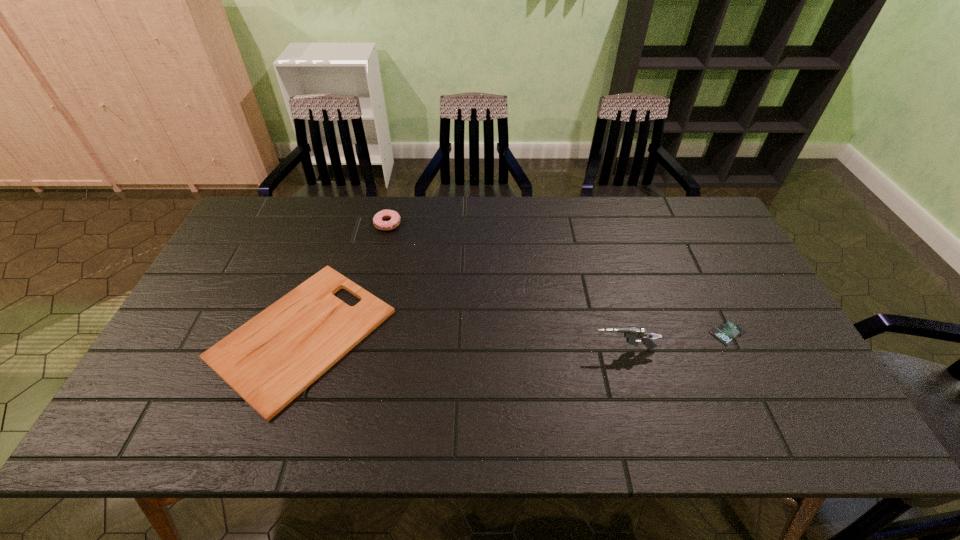
I want to click on unoccupied area between the third shortest object and the gun, so click(506, 287).

Where is `free spot between the tallest object and the third tallest object`? The image size is (960, 540). free spot between the tallest object and the third tallest object is located at coordinates (463, 341).

The height and width of the screenshot is (540, 960). Find the location of `free point between the gun and the rightmost object`. free point between the gun and the rightmost object is located at coordinates [x=676, y=341].

The height and width of the screenshot is (540, 960). Find the location of `object identified as the third closest to the shortest object`. object identified as the third closest to the shortest object is located at coordinates (378, 222).

This screenshot has width=960, height=540. In order to click on object that is the second closest to the chopping board in this screenshot , I will do `click(631, 334)`.

Find the location of a particular element. This screenshot has height=540, width=960. free spot that satisfies the following two spatial constraints: 1. on the back side of the doughnut; 2. on the right side of the second shortest object is located at coordinates (341, 224).

This screenshot has width=960, height=540. I want to click on vacant point that satisfies the following two spatial constraints: 1. on the back side of the second shortest object; 2. on the left side of the second tallest object, so click(x=341, y=224).

Identify the location of vacant region that satisfies the following two spatial constraints: 1. on the front side of the third shortest object; 2. on the right side of the rightmost object. The image size is (960, 540). (363, 333).